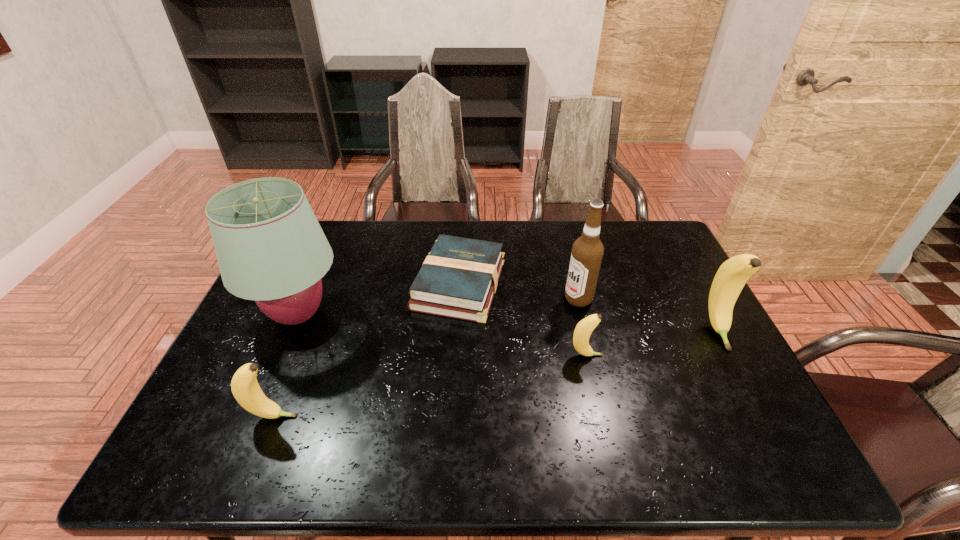
Identify the location of free location that satisfies the following two spatial constraints: 1. from the stem of the tallest banana; 2. from the stem of the leftmost banana. The image size is (960, 540). (763, 416).

Find the location of `vacant space that satisfies the following two spatial constraints: 1. from the stem of the rightmost banana; 2. from the stem of the nearest object`. vacant space that satisfies the following two spatial constraints: 1. from the stem of the rightmost banana; 2. from the stem of the nearest object is located at coordinates (763, 416).

This screenshot has height=540, width=960. In order to click on vacant space that satisfies the following two spatial constraints: 1. from the stem of the third tallest object; 2. from the stem of the second banana from right to left in this screenshot , I will do `click(731, 355)`.

Identify the location of vacant space that satisfies the following two spatial constraints: 1. on the label of the alcohol; 2. on the front side of the lampshade. The width and height of the screenshot is (960, 540). (582, 315).